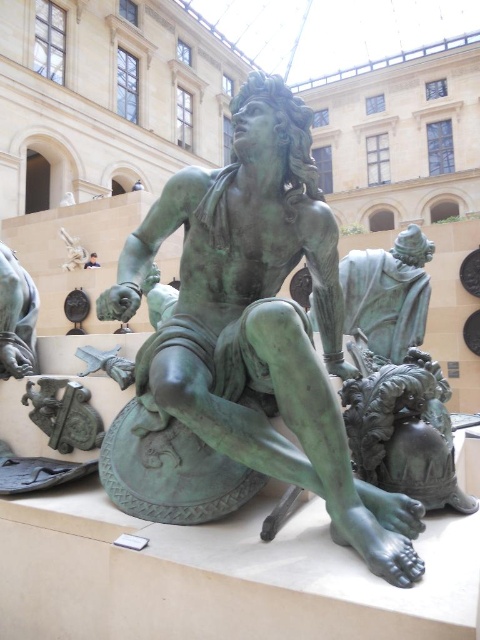
Question: Can you confirm if green patina bronze statue at center is thinner than green patina statue at center?

Choices:
 (A) yes
 (B) no

Answer: (B)

Question: Does green patina bronze statue at center have a greater width compared to green patina statue at center?

Choices:
 (A) no
 (B) yes

Answer: (B)

Question: Where is green patina bronze statue at center located in relation to green patina statue at center in the image?

Choices:
 (A) right
 (B) left

Answer: (A)

Question: Which object appears closest to the camera in this image?

Choices:
 (A) green patina bronze statue at center
 (B) green patina statue at center

Answer: (A)

Question: Which point is closer to the camera taking this photo?

Choices:
 (A) (287, 470)
 (B) (28, 316)

Answer: (A)